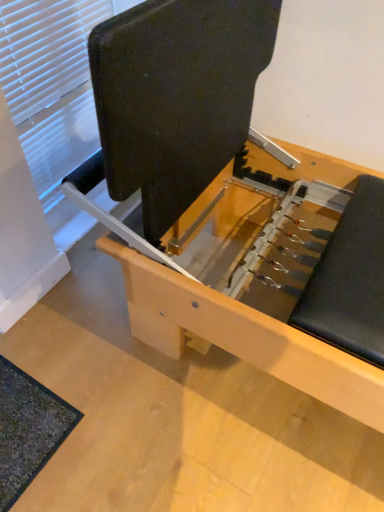
What are the coordinates of `vacant region under dark green textured mat at lower left (from a real-world perspective)` in the screenshot? It's located at (24, 425).